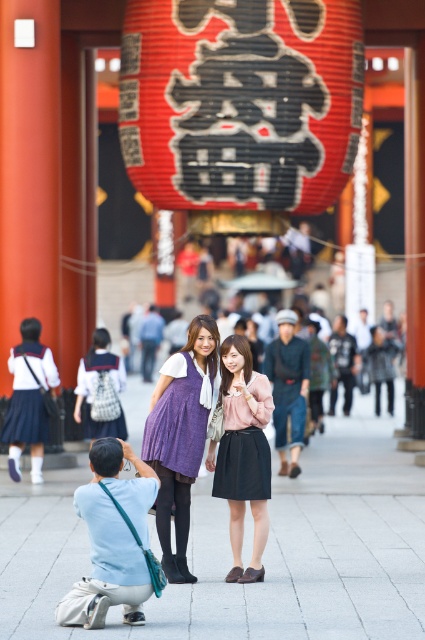
Does red paper lantern at upper center lie in front of matte purple dress at center?

No, red paper lantern at upper center is behind matte purple dress at center.

Find the location of a particular element. Image resolution: width=425 pixels, height=640 pixels. red paper lantern at upper center is located at coordinates (240, 100).

Between point (161, 401) and point (260, 467), which one is positioned in front?

Positioned in front is point (260, 467).

Between purple textured dress at center and matte purple dress at center, which one is positioned higher?

purple textured dress at center is higher up.

Does point (181, 432) come in front of point (252, 378)?

That is False.

Where is `purple textured dress at center`? Image resolution: width=425 pixels, height=640 pixels. purple textured dress at center is located at coordinates (181, 436).

Between red paper lantern at upper center and purple textured dress at center, which one has more height?

With more height is red paper lantern at upper center.

Which is below, red paper lantern at upper center or purple textured dress at center?

purple textured dress at center

Is point (212, 1) behind point (164, 531)?

Yes, it is behind point (164, 531).

Locate an element on the screen. The height and width of the screenshot is (640, 425). red paper lantern at upper center is located at coordinates (240, 100).